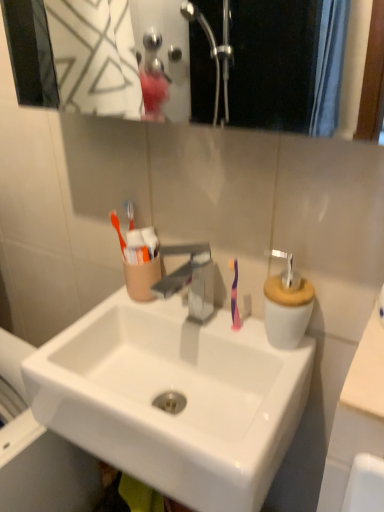
Where is `free space in front of purple glossy toothbrush at center`? The image size is (384, 512). free space in front of purple glossy toothbrush at center is located at coordinates (255, 401).